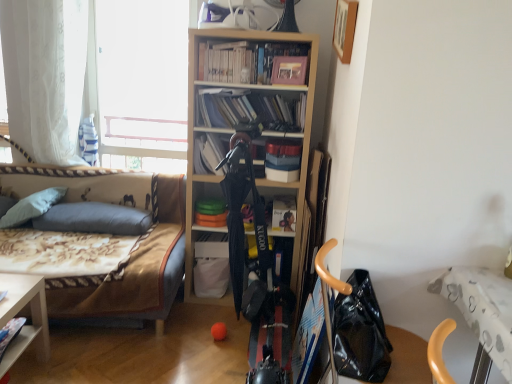
Question: Considering their positions, is white sheer curtain at left located in front of or behind white matte book at center, the fourth book positioned from the top?

Choices:
 (A) front
 (B) behind

Answer: (A)

Question: Based on their sizes in the image, would you say white sheer curtain at left is bigger or smaller than white matte book at center, the first book positioned from the bottom?

Choices:
 (A) big
 (B) small

Answer: (A)

Question: Considering the real-world distances, which object is closest to the floral fabric couch at left?

Choices:
 (A) white soft pillow at left, which ranks as the first pillow in left-to-right order
 (B) matte plastic books at center, which is counted as the 3th book, starting from the bottom
 (C) orange matte ball at center
 (D) white sheer curtain at left
 (E) white matte book at center, the fourth book positioned from the top

Answer: (A)

Question: Estimate the real-world distances between objects in this image. Which object is closer to the matte black book at center, the second book positioned from the bottom?

Choices:
 (A) white matte book at center, the fourth book positioned from the top
 (B) matte gray pillow at left, which is counted as the first pillow, starting from the right
 (C) white soft pillow at left, acting as the 2th pillow starting from the right
 (D) floral fabric couch at left
 (E) white sheer curtain at left

Answer: (A)